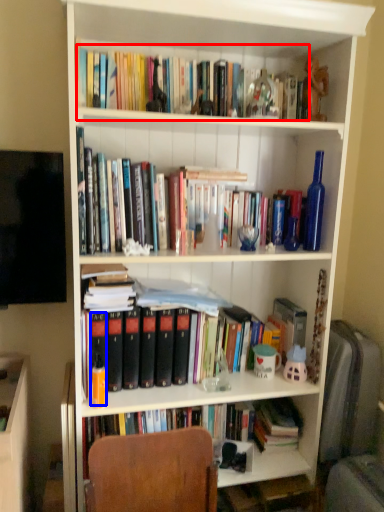
Question: Which object is further to the camera taking this photo, book (highlighted by a red box) or paperback book (highlighted by a blue box)?

Choices:
 (A) book
 (B) paperback book

Answer: (B)